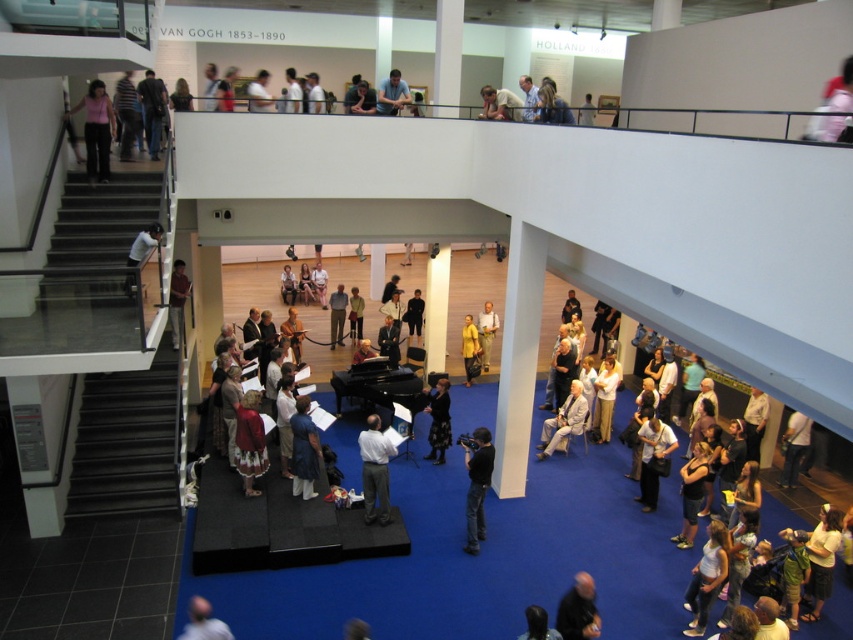
Is blurred black shirt at lower center above white shirt at upper center?

No.

Based on the photo, which is below, blurred black shirt at lower center or white shirt at upper center?

blurred black shirt at lower center is below.

Does point (581, 582) come behind point (254, 88)?

No, it is in front of (254, 88).

Where is `blurred black shirt at lower center`? Image resolution: width=853 pixels, height=640 pixels. blurred black shirt at lower center is located at coordinates (578, 611).

Is black textured dress at center positioned at the back of light brown wooden chair at center?

No.

The height and width of the screenshot is (640, 853). What do you see at coordinates (438, 420) in the screenshot? I see `black textured dress at center` at bounding box center [438, 420].

Which is behind, point (442, 397) or point (334, 320)?

The point (334, 320) is behind.

The image size is (853, 640). I want to click on black textured dress at center, so click(x=438, y=420).

Who is more distant from viewer, (308, 445) or (416, 339)?

Positioned behind is point (416, 339).

Between blue fabric shirt at center and black leather jacket at center, which one has less height?

Standing shorter between the two is black leather jacket at center.

Is point (299, 429) in front of point (410, 326)?

Yes.

Identify the location of blue fabric shirt at center. (x=305, y=451).